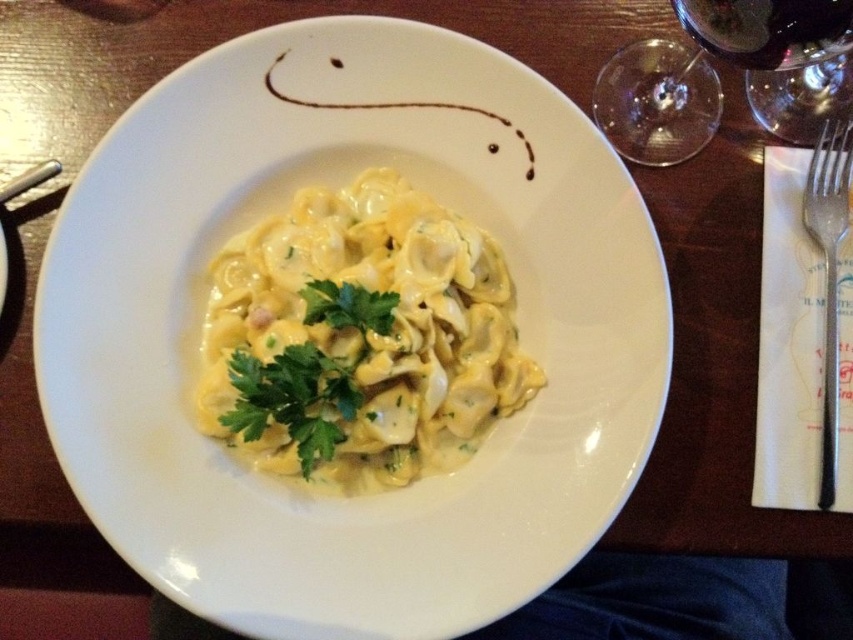
Which is more to the left, yellow creamy pasta at center or dark red glass at upper right?

Positioned to the left is yellow creamy pasta at center.

Is yellow creamy pasta at center wider than dark red glass at upper right?

Yes.

Who is more forward, (288, 308) or (798, 29)?

Point (798, 29) is more forward.

Find the location of a particular element. yellow creamy pasta at center is located at coordinates (358, 339).

Does white glossy plate at center appear under transparent glass wine glass at upper right?

Correct, white glossy plate at center is located below transparent glass wine glass at upper right.

Can you confirm if white glossy plate at center is bigger than transparent glass wine glass at upper right?

Yes.

Where is `white glossy plate at center`? This screenshot has height=640, width=853. white glossy plate at center is located at coordinates (276, 208).

This screenshot has width=853, height=640. Identify the location of white glossy plate at center. (276, 208).

Which is below, yellow creamy pasta at center or satin silver fork at right?

yellow creamy pasta at center is below.

Can you confirm if yellow creamy pasta at center is positioned below satin silver fork at right?

Yes.

This screenshot has height=640, width=853. In order to click on yellow creamy pasta at center in this screenshot , I will do `click(358, 339)`.

The width and height of the screenshot is (853, 640). I want to click on yellow creamy pasta at center, so click(358, 339).